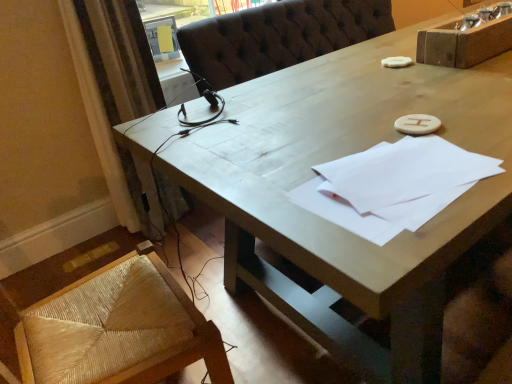
This screenshot has width=512, height=384. Find the location of `vacant space that is to the left of white paper at center`. vacant space that is to the left of white paper at center is located at coordinates (270, 189).